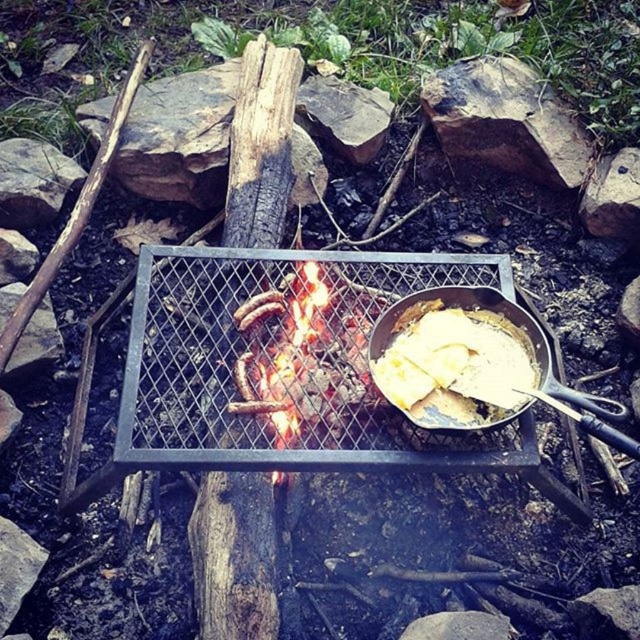
Which is more to the right, silver/black cast iron frying pan at center or white creamy food at center?

Positioned to the right is silver/black cast iron frying pan at center.

Image resolution: width=640 pixels, height=640 pixels. What do you see at coordinates (476, 364) in the screenshot?
I see `silver/black cast iron frying pan at center` at bounding box center [476, 364].

Does point (474, 342) lie behind point (483, 368)?

Yes.

You are a GUI agent. You are given a task and a screenshot of the screen. Output one action in this format:
    pyautogui.click(x=<x>, y=<y>)
    Task: Click on the silver/black cast iron frying pan at center
    The image size is (640, 640).
    Given the screenshot: What is the action you would take?
    pyautogui.click(x=476, y=364)

Is point (593, 433) positioned before point (490, 163)?

Yes, it is.

Describe the element at coordinates (476, 364) in the screenshot. The width and height of the screenshot is (640, 640). I see `silver/black cast iron frying pan at center` at that location.

Describe the element at coordinates (476, 364) in the screenshot. I see `silver/black cast iron frying pan at center` at that location.

Image resolution: width=640 pixels, height=640 pixels. What are the coordinates of `silver/black cast iron frying pan at center` in the screenshot? It's located at (476, 364).

Who is positioned more to the left, white creamy food at center or brown rough rock at upper center?

From the viewer's perspective, white creamy food at center appears more on the left side.

Between point (420, 404) and point (538, 164), which one is positioned behind?

The point (538, 164) is more distant.

Locate an element on the screen. white creamy food at center is located at coordinates (456, 362).